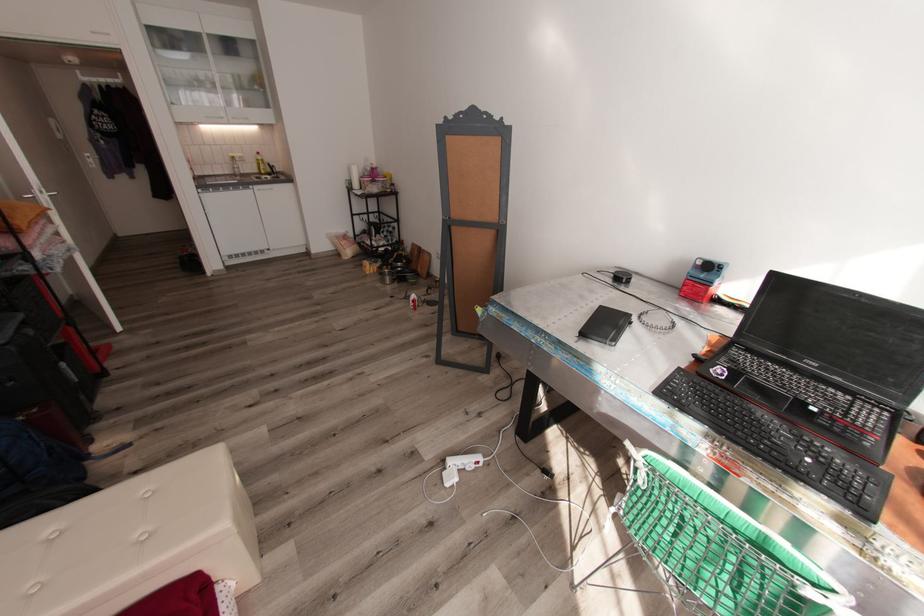
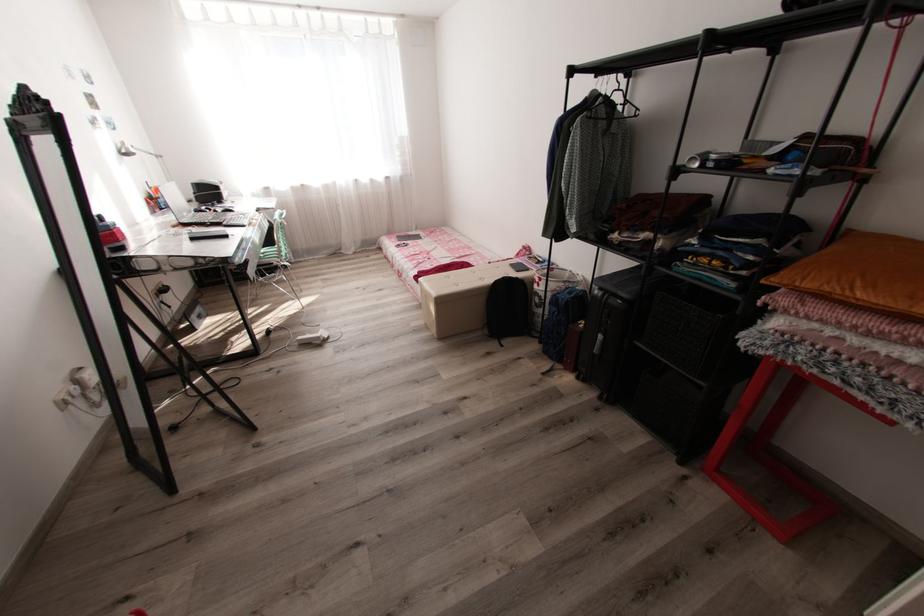
Find the pixel in the second image that matches (67,363) in the first image.

(603, 336)